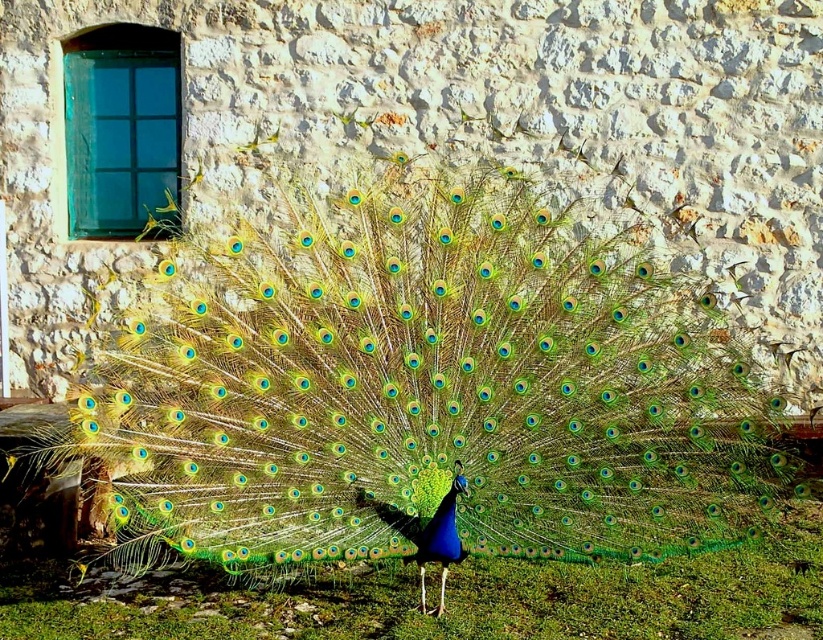
Question: Which of the following is the closest to the observer?

Choices:
 (A) (143, 328)
 (B) (745, 605)

Answer: (A)

Question: Considering the relative positions of green iridescent peacock at center and green grass at center in the image provided, where is green iridescent peacock at center located with respect to green grass at center?

Choices:
 (A) above
 (B) below

Answer: (A)

Question: Does green iridescent peacock at center have a larger size compared to green grass at center?

Choices:
 (A) no
 (B) yes

Answer: (B)

Question: Is green iridescent peacock at center behind green grass at center?

Choices:
 (A) yes
 (B) no

Answer: (B)